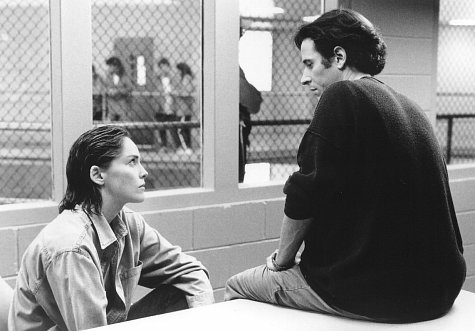
Where is `door`? door is located at coordinates (140, 105).